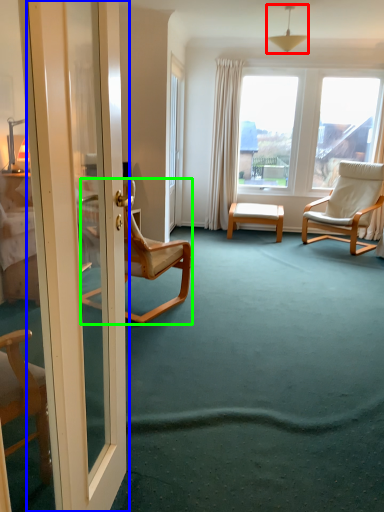
Question: Estimate the real-world distances between objects in this image. Which object is farther from lamp (highlighted by a red box), door (highlighted by a blue box) or chair (highlighted by a green box)?

Choices:
 (A) door
 (B) chair

Answer: (A)